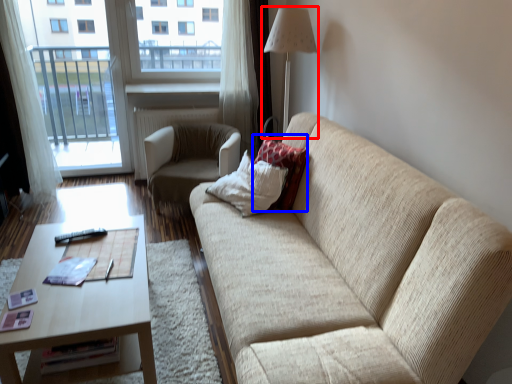
Question: Which of the following is the farthest to the observer, table lamp (highlighted by a red box) or pillow (highlighted by a blue box)?

Choices:
 (A) table lamp
 (B) pillow

Answer: (A)